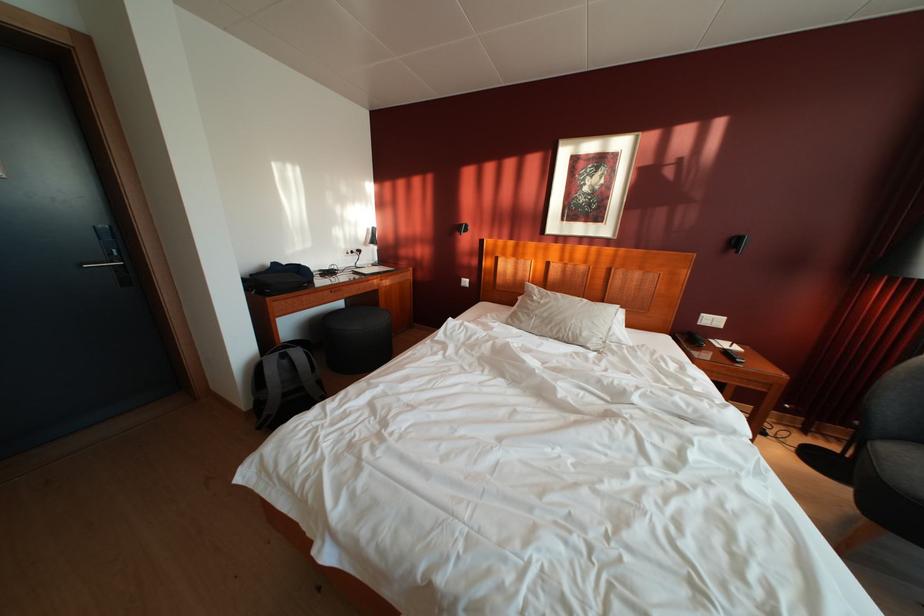
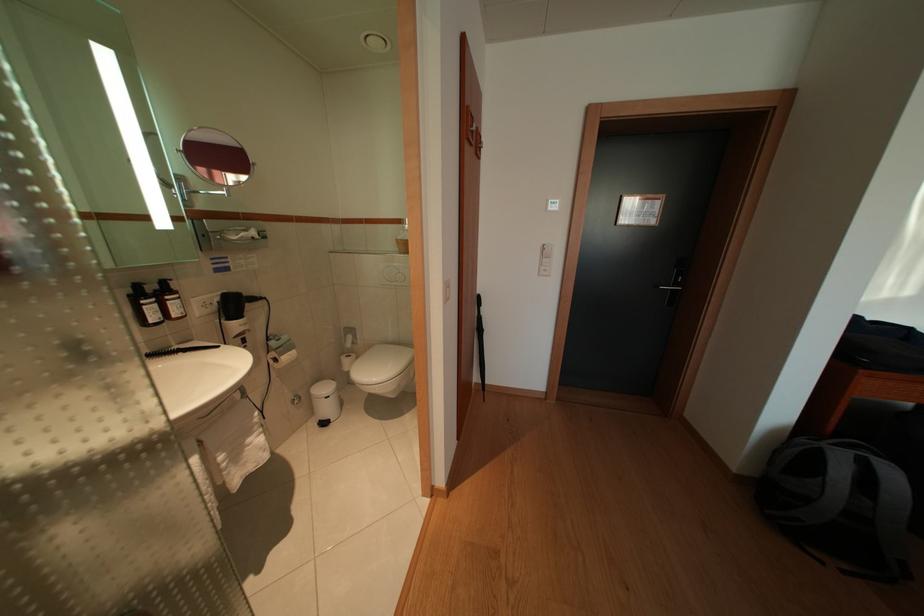
Where in the second image is the point corresponding to point 307,360 from the first image?

(901, 480)